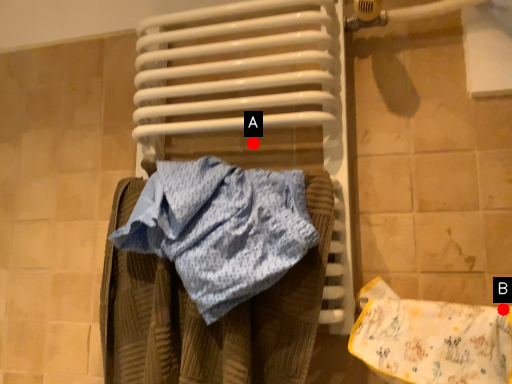
Question: Two points are circled on the image, labeled by A and B beside each circle. Which point is closer to the camera?

Choices:
 (A) A is closer
 (B) B is closer

Answer: (B)